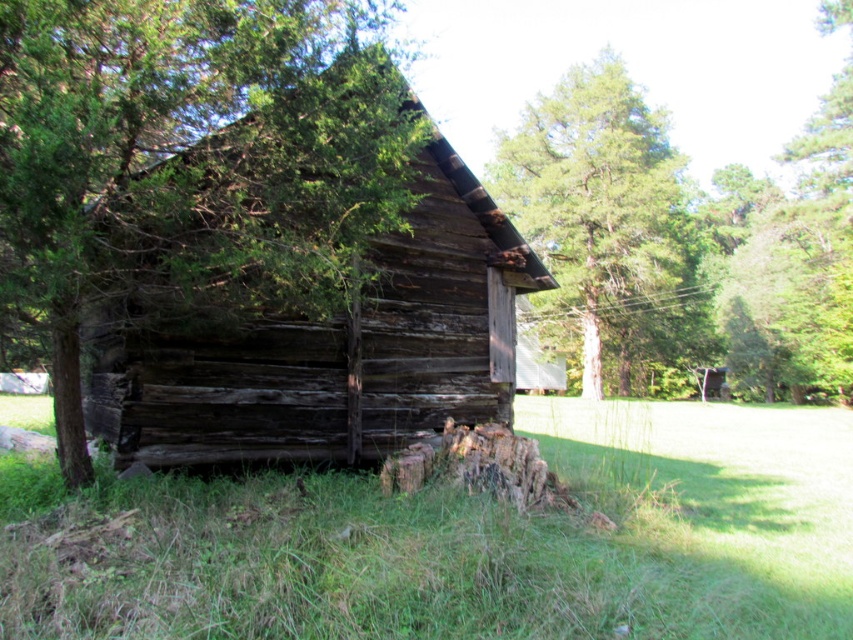
Is point (56, 129) more distant than point (567, 252)?

No, (56, 129) is in front of (567, 252).

Is green leafy tree at center taller than green rough bark tree at upper center?

No.

Is point (268, 224) less distant than point (614, 256)?

Yes, it is in front of point (614, 256).

The height and width of the screenshot is (640, 853). I want to click on green leafy tree at center, so click(x=189, y=164).

Is green grass at lower left positioned in front of green leafy tree at center?

No, it is not.

Which is more to the left, green grass at lower left or green leafy tree at center?

From the viewer's perspective, green leafy tree at center appears more on the left side.

Who is more distant from viewer, [286,532] or [270,211]?

Positioned behind is point [270,211].

I want to click on green grass at lower left, so click(x=462, y=540).

Is point (833, 436) positioned before point (532, 115)?

Yes, it is in front of point (532, 115).

Which is behind, point (418, 614) or point (553, 141)?

The point (553, 141) is behind.

Who is more distant from viewer, (405,592) or (569,200)?

Positioned behind is point (569,200).

This screenshot has height=640, width=853. Identify the location of green grass at lower left. (462, 540).